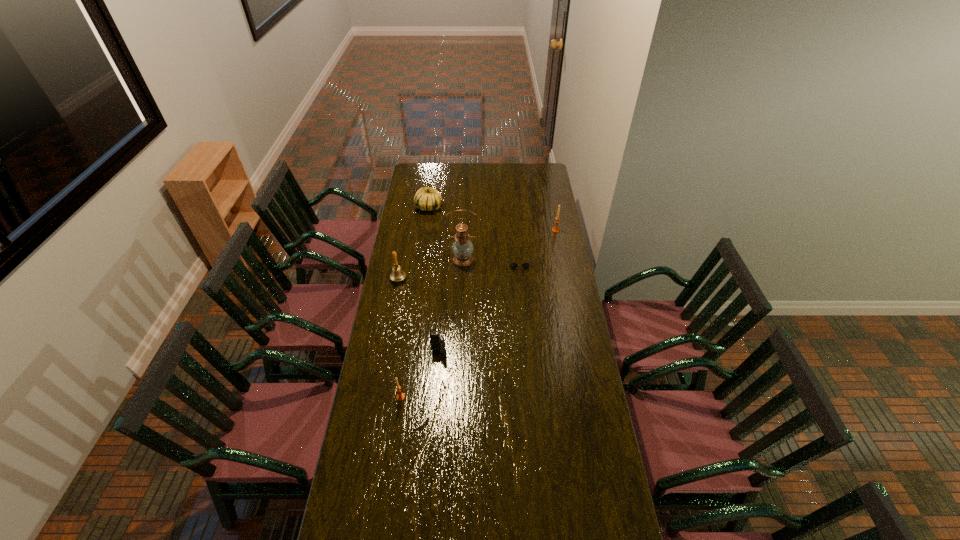
The width and height of the screenshot is (960, 540). In order to click on vacant spot for a new candle_holder to ensure equal spacing in this screenshot , I will do `click(492, 299)`.